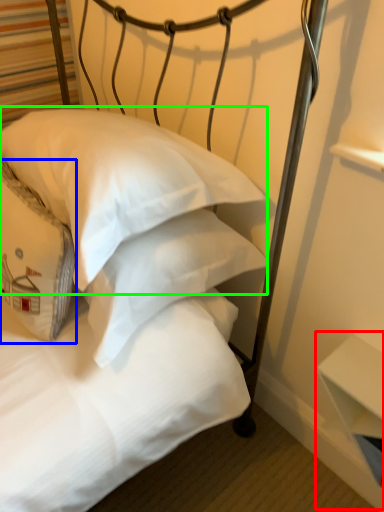
Question: Considering the real-world distances, which object is farthest from table (highlighted by a red box)? pillow (highlighted by a blue box) or pillow (highlighted by a green box)?

Choices:
 (A) pillow
 (B) pillow

Answer: (A)